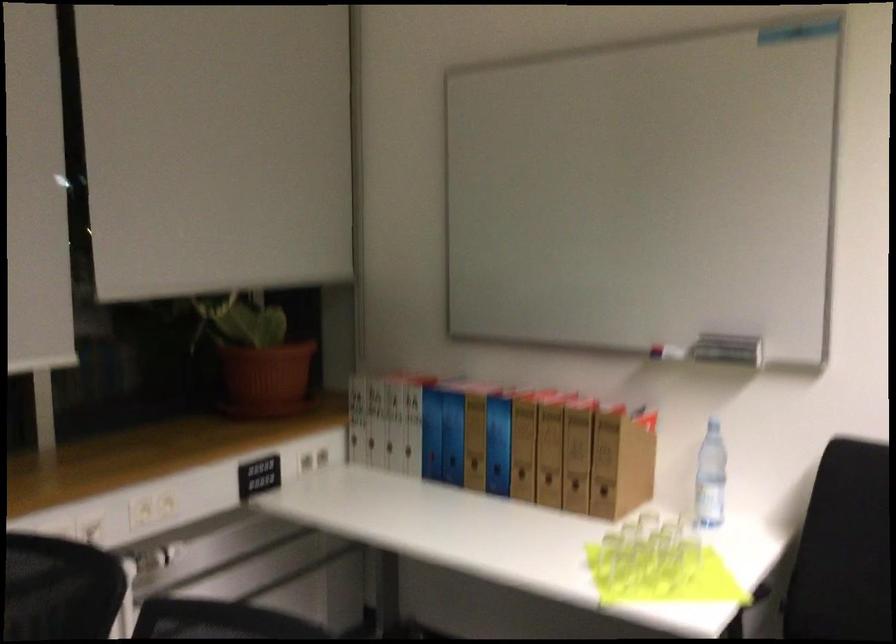
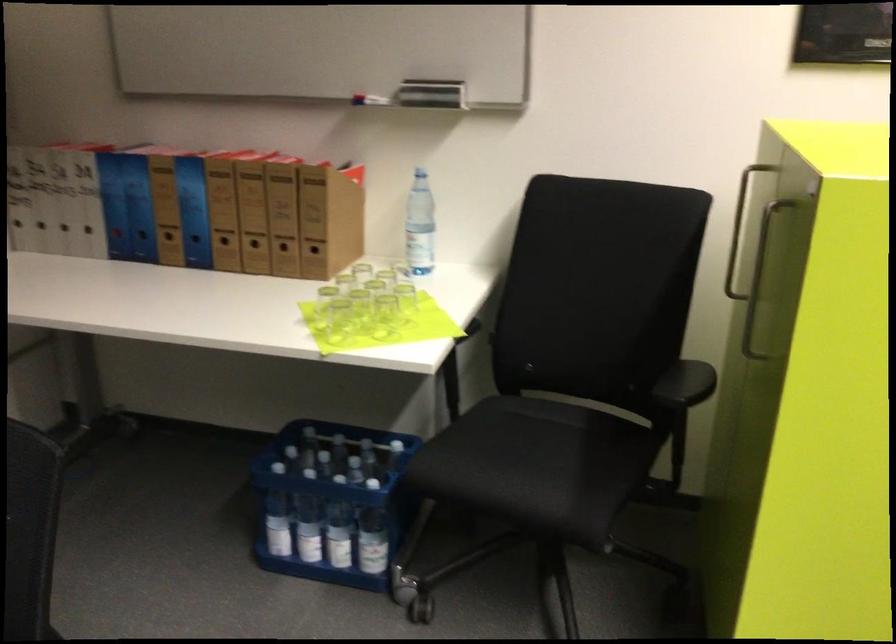
Locate, in the second image, the point that corresponds to (x=695, y=556) in the first image.

(405, 299)